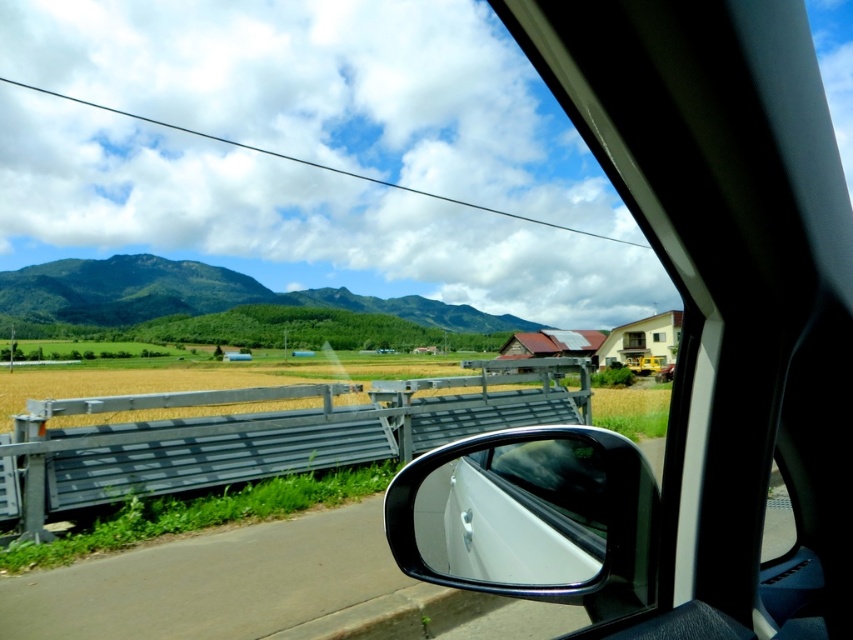
Who is positioned more to the left, black glossy side mirror at center or green forested mountain at left?

From the viewer's perspective, green forested mountain at left appears more on the left side.

Does black glossy side mirror at center have a greater height compared to green forested mountain at left?

No.

Image resolution: width=853 pixels, height=640 pixels. Describe the element at coordinates (531, 516) in the screenshot. I see `black glossy side mirror at center` at that location.

Image resolution: width=853 pixels, height=640 pixels. Identify the location of black glossy side mirror at center. (531, 516).